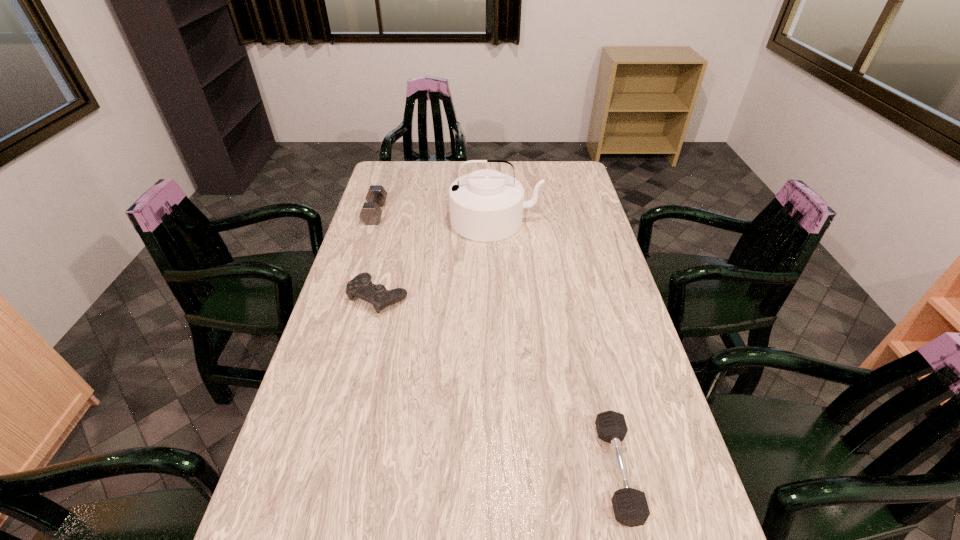
Locate an element on the screen. The width and height of the screenshot is (960, 540). kettle is located at coordinates (486, 205).

Locate an element on the screen. This screenshot has width=960, height=540. the tallest object is located at coordinates (x=486, y=205).

Find the location of a particular element. Image resolution: width=960 pixels, height=540 pixels. the farther dumbbell is located at coordinates (371, 212).

Find the location of a particular element. control is located at coordinates (361, 286).

Where is `the rightmost object`? the rightmost object is located at coordinates (630, 506).

Where is `the right dumbbell`? The image size is (960, 540). the right dumbbell is located at coordinates (630, 506).

Where is `free space located 0.050m on the spout of the tallest object`? free space located 0.050m on the spout of the tallest object is located at coordinates (496, 251).

Locate an element on the screen. The image size is (960, 540). vacant space located on the back of the farther dumbbell is located at coordinates (388, 173).

Find the location of `vacant space located 0.350m on the right of the control`. vacant space located 0.350m on the right of the control is located at coordinates (519, 296).

Where is `vacant area situated on the back of the nearer dumbbell`? vacant area situated on the back of the nearer dumbbell is located at coordinates (600, 397).